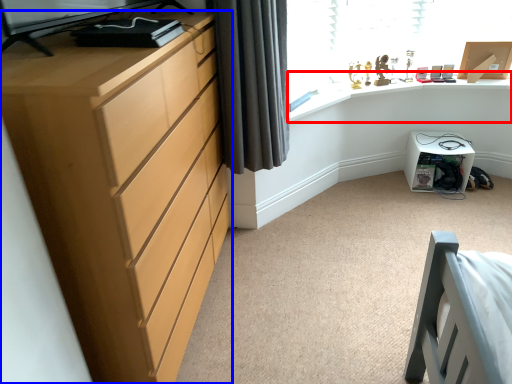
Question: Among these objects, which one is farthest to the camera, computer desk (highlighted by a red box) or chest of drawers (highlighted by a blue box)?

Choices:
 (A) computer desk
 (B) chest of drawers

Answer: (A)